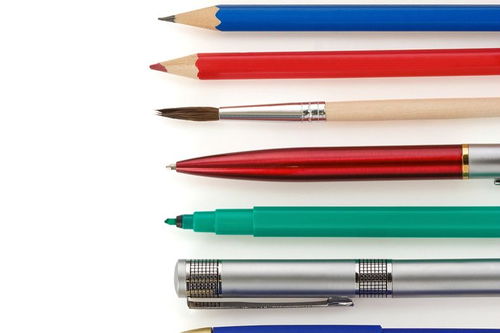
Where is `writing tools`? Image resolution: width=500 pixels, height=333 pixels. writing tools is located at coordinates (262, 12), (242, 65), (322, 110), (299, 172), (283, 222), (283, 278), (289, 328).